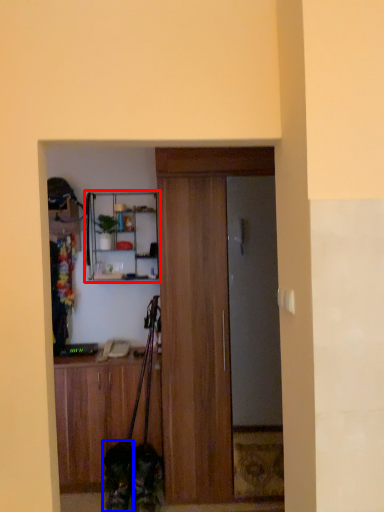
Question: Which object is further to the camera taking this photo, shelf (highlighted by a red box) or dog (highlighted by a blue box)?

Choices:
 (A) shelf
 (B) dog

Answer: (A)